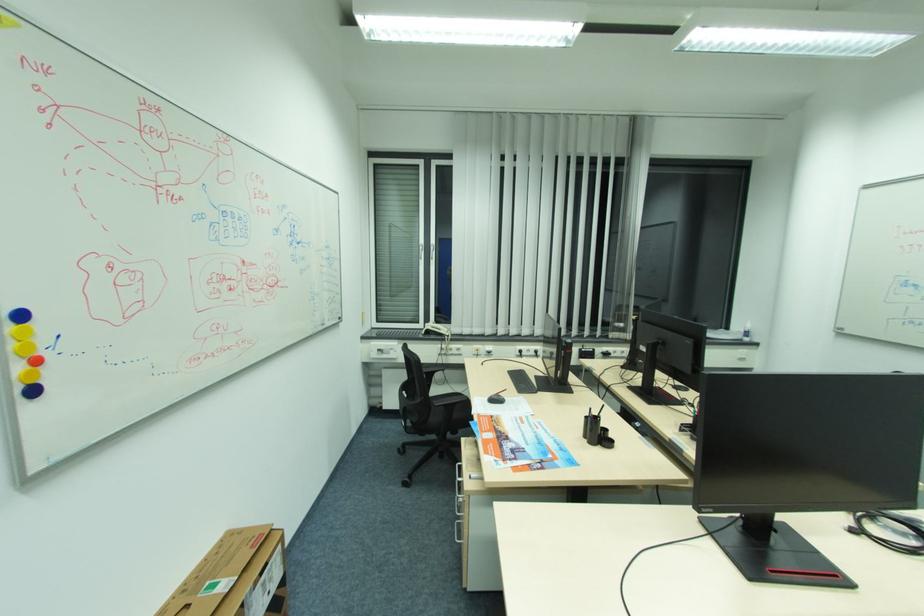
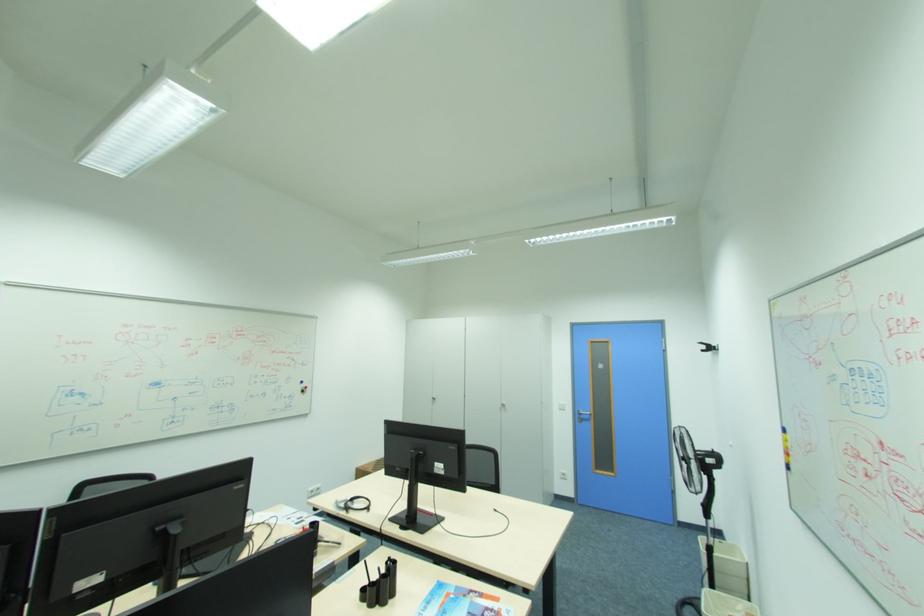
The point at (x=520, y=459) is marked in the first image. Where is the corresponding point in the second image?

(492, 610)